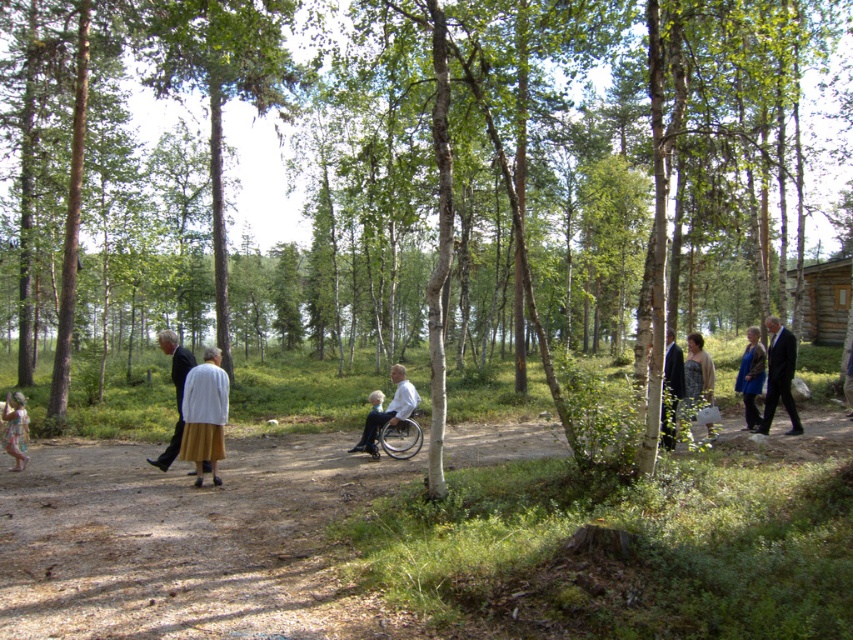
Question: Estimate the real-world distances between objects in this image. Which object is closer to the white woolen coat at lower left?

Choices:
 (A) dark blue suit at center
 (B) silver metallic wheelchair at center
 (C) light beige skirt at lower left

Answer: (C)

Question: Which is farther from the dark blue suit at center?

Choices:
 (A) dark suit at right
 (B) white matte wheelchair at center
 (C) dark gray wool coat at right
 (D) silver metallic wheelchair at center

Answer: (B)

Question: Can you confirm if white woolen coat at lower left is smaller than dark gray wool coat at right?

Choices:
 (A) no
 (B) yes

Answer: (A)

Question: Is dark blue suit at center above dark blue suit at right?

Choices:
 (A) no
 (B) yes

Answer: (A)

Question: Among these points, which one is farthest from the camera?

Choices:
 (A) (387, 432)
 (B) (740, 365)
 (C) (22, 426)

Answer: (B)

Question: Is dark blue suit at right smaller than silver metallic wheelchair at center?

Choices:
 (A) no
 (B) yes

Answer: (A)